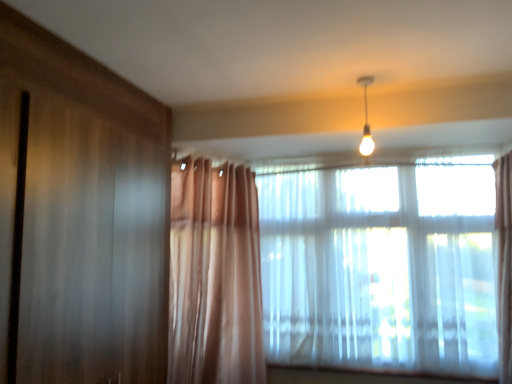
Question: Does translucent fabric window at center, the 1th window when ordered from left to right, come behind matte white bulb at upper center?

Choices:
 (A) no
 (B) yes

Answer: (B)

Question: Could you tell me if translucent fabric window at center, acting as the 2th window starting from the right, is turned towards matte white bulb at upper center?

Choices:
 (A) no
 (B) yes

Answer: (B)

Question: Is translucent fabric window at center, acting as the 2th window starting from the right, to the right of matte white bulb at upper center from the viewer's perspective?

Choices:
 (A) no
 (B) yes

Answer: (B)

Question: Is translucent fabric window at center, acting as the 2th window starting from the right, positioned with its back to matte white bulb at upper center?

Choices:
 (A) yes
 (B) no

Answer: (B)

Question: From a real-world perspective, is translucent fabric window at center, acting as the 2th window starting from the right, below matte white bulb at upper center?

Choices:
 (A) yes
 (B) no

Answer: (A)

Question: From a real-world perspective, is translucent fabric window at upper right, acting as the second window starting from the left, above or below matte white bulb at upper center?

Choices:
 (A) below
 (B) above

Answer: (A)

Question: Is translucent fabric window at upper right, acting as the second window starting from the left, inside or outside of matte white bulb at upper center?

Choices:
 (A) outside
 (B) inside

Answer: (A)

Question: Is translucent fabric window at upper right, placed as the first window when sorted from right to left, to the left or to the right of matte white bulb at upper center in the image?

Choices:
 (A) left
 (B) right

Answer: (B)

Question: Is point (486, 289) positioned closer to the camera than point (362, 150)?

Choices:
 (A) farther
 (B) closer

Answer: (B)

Question: In the image, is translucent fabric window at center, the 1th window when ordered from left to right, positioned in front of or behind matte white bulb at upper center?

Choices:
 (A) front
 (B) behind

Answer: (B)

Question: Considering the positions of translucent fabric window at center, acting as the 2th window starting from the right, and matte white bulb at upper center in the image, is translucent fabric window at center, acting as the 2th window starting from the right, taller or shorter than matte white bulb at upper center?

Choices:
 (A) tall
 (B) short

Answer: (A)

Question: Based on their positions, is translucent fabric window at center, acting as the 2th window starting from the right, located to the left or right of matte white bulb at upper center?

Choices:
 (A) right
 (B) left

Answer: (A)

Question: Is translucent fabric window at center, acting as the 2th window starting from the right, spatially inside matte white bulb at upper center, or outside of it?

Choices:
 (A) inside
 (B) outside

Answer: (B)

Question: Is point (289, 248) positioned closer to the camera than point (478, 369)?

Choices:
 (A) farther
 (B) closer

Answer: (A)

Question: Based on their sizes in the image, would you say translucent fabric window at center, the 1th window when ordered from left to right, is bigger or smaller than translucent fabric window at upper right, acting as the second window starting from the left?

Choices:
 (A) small
 (B) big

Answer: (A)